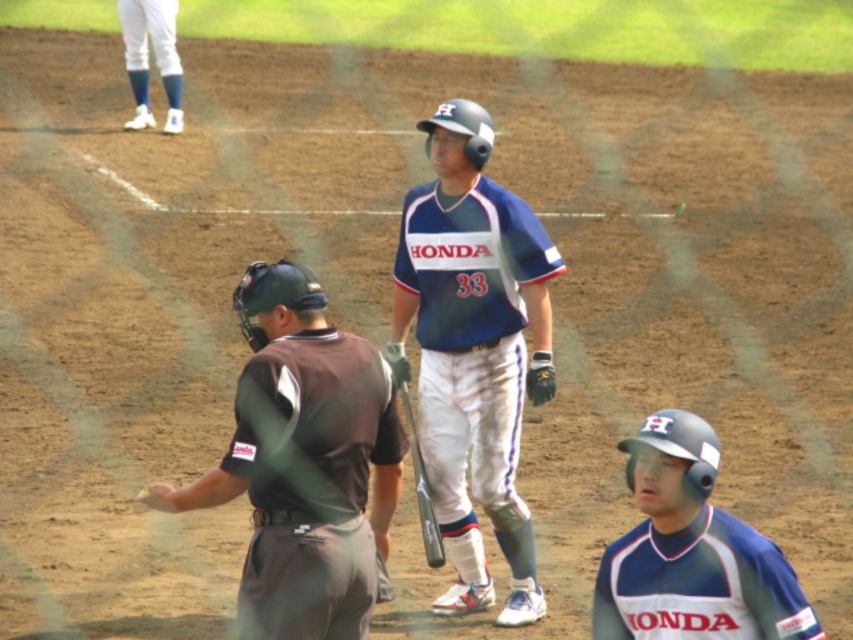
Can you confirm if blue/white socks at upper left is positioned to the right of dark gray leather glove at center?

In fact, blue/white socks at upper left is to the left of dark gray leather glove at center.

Does blue/white socks at upper left have a greater width compared to dark gray leather glove at center?

Correct, the width of blue/white socks at upper left exceeds that of dark gray leather glove at center.

You are a GUI agent. You are given a task and a screenshot of the screen. Output one action in this format:
    pyautogui.click(x=<x>, y=<y>)
    Task: Click on the blue/white socks at upper left
    The height and width of the screenshot is (640, 853).
    Given the screenshot: What is the action you would take?
    pyautogui.click(x=154, y=58)

Locate an element on the screen. The width and height of the screenshot is (853, 640). blue/white socks at upper left is located at coordinates (154, 58).

Can you confirm if dark green uniform at center is shorter than black leather glove at center?

Incorrect, dark green uniform at center's height does not fall short of black leather glove at center's.

Can you confirm if dark green uniform at center is taller than black leather glove at center?

Correct, dark green uniform at center is much taller as black leather glove at center.

Does point (323, 636) come closer to viewer compared to point (547, 392)?

That is True.

The width and height of the screenshot is (853, 640). What are the coordinates of `dark green uniform at center` in the screenshot? It's located at (305, 464).

Is point (254, 404) positioned after point (437, 561)?

No.

Identify the location of dark green uniform at center. (305, 464).